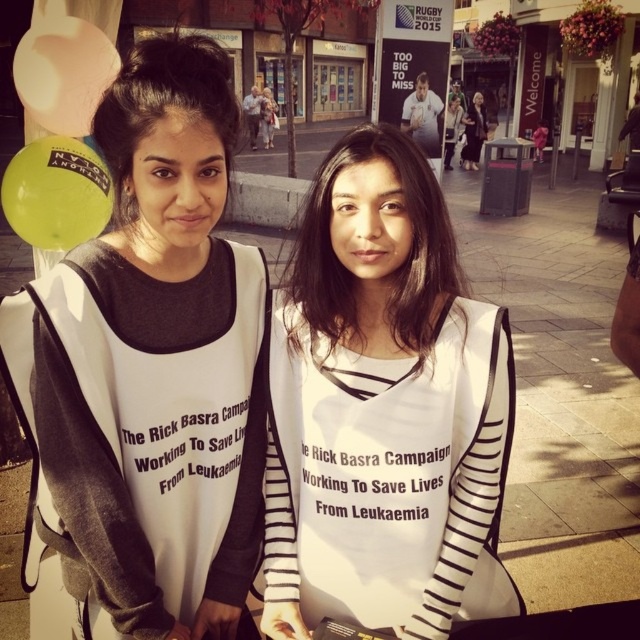
Question: Estimate the real-world distances between objects in this image. Which object is farther from the white striped shirt at center?

Choices:
 (A) matte black shirt at upper center
 (B) dark brown hair at center
 (C) black matte hair at upper left

Answer: (A)

Question: Does rubber balloon at upper left have a lesser width compared to matte black shirt at upper center?

Choices:
 (A) no
 (B) yes

Answer: (B)

Question: Considering the relative positions of white jersey at left and white striped shirt at center in the image provided, where is white jersey at left located with respect to white striped shirt at center?

Choices:
 (A) right
 (B) left

Answer: (B)

Question: Does white jersey at left appear on the left side of matte black shirt at upper center?

Choices:
 (A) yes
 (B) no

Answer: (A)

Question: Which is farther from the green rubber balloon at upper left?

Choices:
 (A) rubber balloon at upper left
 (B) black matte hair at upper left
 (C) dark brown hair at center
 (D) matte black shirt at upper center

Answer: (D)

Question: Which of the following is the closest to the observer?

Choices:
 (A) matte black shirt at upper center
 (B) green rubber balloon at upper left
 (C) dark brown hair at center

Answer: (C)